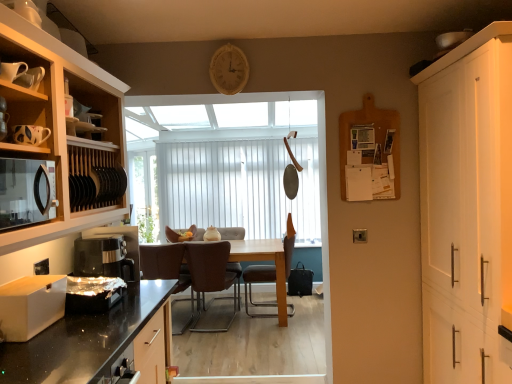
Question: Should I look upward or downward to see brown leather chair at center, which ranks as the 2th chair in right-to-left order?

Choices:
 (A) up
 (B) down

Answer: (B)

Question: Can you confirm if brown leather chair at center, the third chair from the left, is taller than white matte drawer at lower left, the 2th appliance positioned from the back?

Choices:
 (A) yes
 (B) no

Answer: (A)

Question: Does brown leather chair at center, marked as the 1th chair in a right-to-left arrangement, have a smaller size compared to white matte drawer at lower left, acting as the 1th appliance starting from the front?

Choices:
 (A) no
 (B) yes

Answer: (A)

Question: Does brown leather chair at center, marked as the 1th chair in a right-to-left arrangement, have a lesser height compared to white matte drawer at lower left, the 2th appliance positioned from the back?

Choices:
 (A) no
 (B) yes

Answer: (A)

Question: Considering the relative sizes of brown leather chair at center, marked as the 1th chair in a right-to-left arrangement, and white matte drawer at lower left, which is the first appliance from left to right, in the image provided, is brown leather chair at center, marked as the 1th chair in a right-to-left arrangement, wider than white matte drawer at lower left, which is the first appliance from left to right,?

Choices:
 (A) yes
 (B) no

Answer: (A)

Question: From a real-world perspective, is brown leather chair at center, the third chair from the left, on top of white matte drawer at lower left, the 2th appliance positioned from the back?

Choices:
 (A) no
 (B) yes

Answer: (A)

Question: Is brown leather chair at center, the third chair from the left, not within white matte drawer at lower left, marked as the second appliance in a right-to-left arrangement?

Choices:
 (A) no
 (B) yes

Answer: (B)

Question: Does white matte drawer at lower left, the 2th appliance positioned from the back, have a lesser height compared to shiny metallic toaster at lower left, the 2th appliance from the front?

Choices:
 (A) no
 (B) yes

Answer: (A)

Question: Considering the relative sizes of white matte drawer at lower left, which is the first appliance from left to right, and shiny metallic toaster at lower left, which is the first appliance in right-to-left order, in the image provided, is white matte drawer at lower left, which is the first appliance from left to right, taller than shiny metallic toaster at lower left, which is the first appliance in right-to-left order,?

Choices:
 (A) yes
 (B) no

Answer: (A)

Question: Is white matte drawer at lower left, acting as the 1th appliance starting from the front, positioned with its back to shiny metallic toaster at lower left, which is counted as the second appliance, starting from the left?

Choices:
 (A) yes
 (B) no

Answer: (B)

Question: Is white matte drawer at lower left, marked as the second appliance in a right-to-left arrangement, located outside shiny metallic toaster at lower left, which is the first appliance in right-to-left order?

Choices:
 (A) yes
 (B) no

Answer: (A)

Question: Could you tell me if white matte drawer at lower left, the 2th appliance positioned from the back, is turned towards shiny metallic toaster at lower left, which is the first appliance in right-to-left order?

Choices:
 (A) yes
 (B) no

Answer: (B)

Question: Can you confirm if white matte drawer at lower left, the 2th appliance positioned from the back, is wider than shiny metallic toaster at lower left, the 2th appliance from the front?

Choices:
 (A) yes
 (B) no

Answer: (B)

Question: Considering the relative positions of black matte microwave at left and white vertical blinds at center in the image provided, is black matte microwave at left in front of white vertical blinds at center?

Choices:
 (A) yes
 (B) no

Answer: (A)